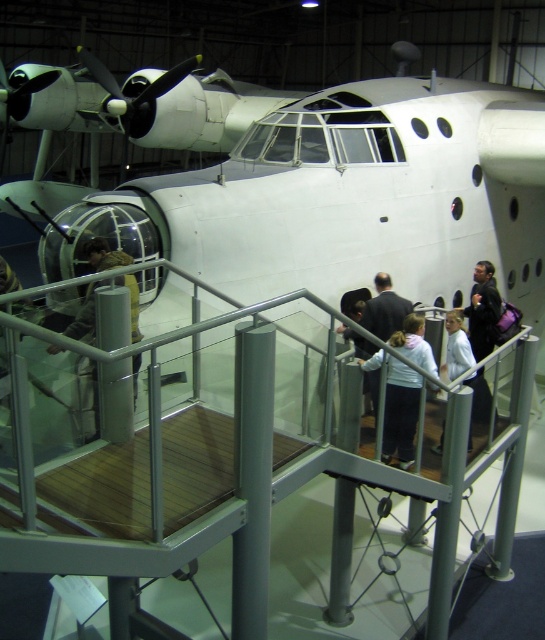
From the picture: You are a visitor at the museum and you want to take a photo of both the camouflage fabric jacket at center and the light gray sweater at right. From which side of the raised platform should you stand to ensure both are visible in your frame?

You should stand to the left of the camouflage fabric jacket at center so that both the camouflage fabric jacket at center and the light gray sweater at right are visible in your frame since the camouflage fabric jacket at center is to the left of the light gray sweater at right.

You are a visitor at the aircraft museum and want to take a photo of the camouflage fabric jacket at center. Where should you stand to get the best view?

The camouflage fabric jacket at center is located at point (104, 253), so you should stand in front of it to capture it clearly.